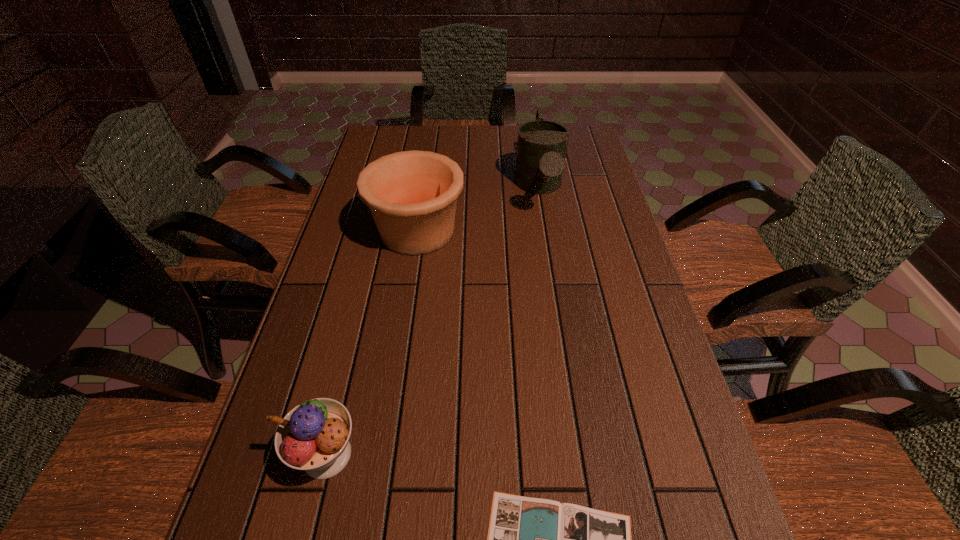
Find the location of `the tallest object`. the tallest object is located at coordinates (541, 147).

You are a GUI agent. You are given a task and a screenshot of the screen. Output one action in this format:
    pyautogui.click(x=<x>, y=<y>)
    Task: Click on the pottery
    The height and width of the screenshot is (540, 960).
    Given the screenshot: What is the action you would take?
    pyautogui.click(x=412, y=195)

Locate an element on the screen. Image resolution: width=960 pixels, height=540 pixels. the third farthest object is located at coordinates (314, 436).

At what (x,y) coordinates should I click in order to perform the action: click on free region located with the spout on the tallest object. Please return your answer as a coordinate pair (x, y). Looking at the image, I should click on (555, 284).

Image resolution: width=960 pixels, height=540 pixels. What are the coordinates of `free space located on the front of the pottery` in the screenshot? It's located at (396, 366).

At what (x,y) coordinates should I click in order to perform the action: click on vacant region located on the right of the icecream. Please return your answer as a coordinate pair (x, y). The image size is (960, 540). Looking at the image, I should click on (502, 455).

Find the location of a particular element. This screenshot has height=540, width=960. object that is at the far edge is located at coordinates (541, 147).

Where is `pottery located in the left edge section of the desktop`? Image resolution: width=960 pixels, height=540 pixels. pottery located in the left edge section of the desktop is located at coordinates (412, 195).

Locate an element on the screen. icecream present at the left edge is located at coordinates (314, 436).

At what (x,y) coordinates should I click in order to perform the action: click on object present at the right edge. Please return your answer as a coordinate pair (x, y). Looking at the image, I should click on (541, 147).